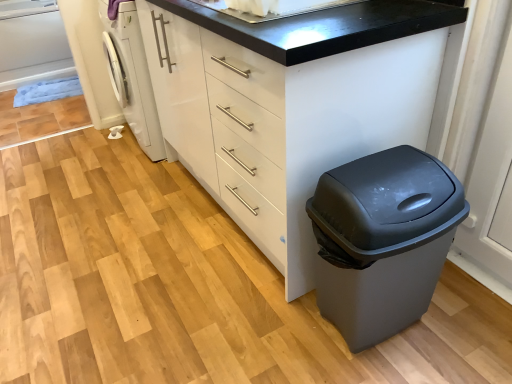
The height and width of the screenshot is (384, 512). What do you see at coordinates (291, 103) in the screenshot?
I see `white matte chest of drawers at center` at bounding box center [291, 103].

What are the coordinates of `white matte chest of drawers at center` in the screenshot? It's located at [x=291, y=103].

From the picture: How far apart are white glossy washing machine at left and white glossy sink at upper center?

white glossy washing machine at left is 1.09 meters from white glossy sink at upper center.

Is white glossy washing machine at left not within white glossy sink at upper center?

Indeed, white glossy washing machine at left is completely outside white glossy sink at upper center.

Considering the points (151, 159) and (210, 7), which point is in front, point (151, 159) or point (210, 7)?

The point (210, 7) is closer to the camera.

Which object is further away from the camera, white glossy washing machine at left or white glossy sink at upper center?

white glossy washing machine at left is more distant.

From a real-world perspective, is white glossy sink at upper center physically above white matte chest of drawers at center?

Yes.

Is white glossy sink at upper center in front of white matte chest of drawers at center?

That is False.

Looking at this image, is white glossy sink at upper center inside or outside of white matte chest of drawers at center?

white glossy sink at upper center is not inside white matte chest of drawers at center, it's outside.

Is white glossy sink at upper center positioned far away from white matte chest of drawers at center?

white glossy sink at upper center is actually quite close to white matte chest of drawers at center.

In terms of width, does matte gray plastic trash can at lower right look wider or thinner when compared to white glossy sink at upper center?

matte gray plastic trash can at lower right is thinner than white glossy sink at upper center.

Considering the sizes of matte gray plastic trash can at lower right and white glossy sink at upper center in the image, is matte gray plastic trash can at lower right taller or shorter than white glossy sink at upper center?

In the image, matte gray plastic trash can at lower right appears to be taller than white glossy sink at upper center.

Measure the distance between matte gray plastic trash can at lower right and white glossy sink at upper center.

68.96 centimeters.

From a real-world perspective, between matte gray plastic trash can at lower right and white glossy sink at upper center, who is vertically lower?

matte gray plastic trash can at lower right, from a real-world perspective.

Between white glossy sink at upper center and white glossy washing machine at left, which one has less height?

With less height is white glossy sink at upper center.

From a real-world perspective, who is located lower, white glossy sink at upper center or white glossy washing machine at left?

white glossy washing machine at left is physically lower.

Does white glossy sink at upper center appear on the left side of white glossy washing machine at left?

No, white glossy sink at upper center is not to the left of white glossy washing machine at left.

Considering their positions, is white glossy sink at upper center located in front of or behind white glossy washing machine at left?

white glossy sink at upper center is in front of white glossy washing machine at left.

How many degrees apart are the facing directions of matte gray plastic trash can at lower right and white glossy washing machine at left?

They differ by 86 degrees in their facing directions.

Which is more to the right, matte gray plastic trash can at lower right or white glossy washing machine at left?

matte gray plastic trash can at lower right is more to the right.

Looking at this image, which of these two, matte gray plastic trash can at lower right or white glossy washing machine at left, is bigger?

With larger size is white glossy washing machine at left.

From a real-world perspective, which object stands above the other?

white glossy washing machine at left, from a real-world perspective.

Which is more to the left, white matte chest of drawers at center or white glossy washing machine at left?

Positioned to the left is white glossy washing machine at left.

How much distance is there between white matte chest of drawers at center and white glossy washing machine at left?

A distance of 31.21 inches exists between white matte chest of drawers at center and white glossy washing machine at left.

In the scene shown: Between white matte chest of drawers at center and white glossy washing machine at left, which one has smaller size?

With smaller size is white glossy washing machine at left.

Considering the sizes of objects white matte chest of drawers at center and white glossy sink at upper center in the image provided, who is bigger, white matte chest of drawers at center or white glossy sink at upper center?

white matte chest of drawers at center is bigger.

Which point is more forward, (294, 180) or (222, 4)?

The point (222, 4) is closer.

In order to click on the chest of drawers in front of the white glossy sink at upper center in this screenshot , I will do `click(291, 103)`.

From a real-world perspective, is white matte chest of drawers at center over white glossy sink at upper center?

No, from a real-world perspective, white matte chest of drawers at center is not over white glossy sink at upper center

At what (x,y) coordinates should I click in order to perform the action: click on washing machine behind the white glossy sink at upper center. Please return your answer as a coordinate pair (x, y). Looking at the image, I should click on (131, 75).

The height and width of the screenshot is (384, 512). Find the location of `sink on the right of the white matte chest of drawers at center`. sink on the right of the white matte chest of drawers at center is located at coordinates (269, 13).

Looking at this image, when comparing their distances from white matte chest of drawers at center, does white glossy sink at upper center or white glossy washing machine at left seem further?

Among the two, white glossy washing machine at left is located further to white matte chest of drawers at center.

Estimate the real-world distances between objects in this image. Which object is closer to white matte chest of drawers at center, matte gray plastic trash can at lower right or white glossy sink at upper center?

matte gray plastic trash can at lower right is positioned closer to the anchor white matte chest of drawers at center.

Looking at the image, which one is located closer to white glossy washing machine at left, white glossy sink at upper center or matte gray plastic trash can at lower right?

white glossy sink at upper center.

Which object lies further to the anchor point white glossy washing machine at left, matte gray plastic trash can at lower right or white matte chest of drawers at center?

Among the two, matte gray plastic trash can at lower right is located further to white glossy washing machine at left.

Estimate the real-world distances between objects in this image. Which object is further from white glossy sink at upper center, white glossy washing machine at left or matte gray plastic trash can at lower right?

white glossy washing machine at left is further to white glossy sink at upper center.

Considering their positions, is white glossy washing machine at left positioned further to white matte chest of drawers at center than white glossy sink at upper center?

white glossy washing machine at left is positioned further to the anchor white matte chest of drawers at center.

When comparing their distances from matte gray plastic trash can at lower right, does white matte chest of drawers at center or white glossy washing machine at left seem further?

Based on the image, white glossy washing machine at left appears to be further to matte gray plastic trash can at lower right.

Considering their positions, is white matte chest of drawers at center positioned further to white glossy washing machine at left than white glossy sink at upper center?

The object further to white glossy washing machine at left is white glossy sink at upper center.

The height and width of the screenshot is (384, 512). In order to click on sink between white matte chest of drawers at center and white glossy washing machine at left from front to back in this screenshot , I will do `click(269, 13)`.

This screenshot has width=512, height=384. I want to click on sink between white glossy washing machine at left and matte gray plastic trash can at lower right from left to right, so click(269, 13).

You are a GUI agent. You are given a task and a screenshot of the screen. Output one action in this format:
    pyautogui.click(x=<x>, y=<y>)
    Task: Click on the chest of drawers between white glossy washing machine at left and matte gray plastic trash can at lower right from left to right
    The width and height of the screenshot is (512, 384).
    Given the screenshot: What is the action you would take?
    pyautogui.click(x=291, y=103)

You are a GUI agent. You are given a task and a screenshot of the screen. Output one action in this format:
    pyautogui.click(x=<x>, y=<y>)
    Task: Click on the chest of drawers between white glossy sink at upper center and matte gray plastic trash can at lower right in the up-down direction
    
    Given the screenshot: What is the action you would take?
    pyautogui.click(x=291, y=103)